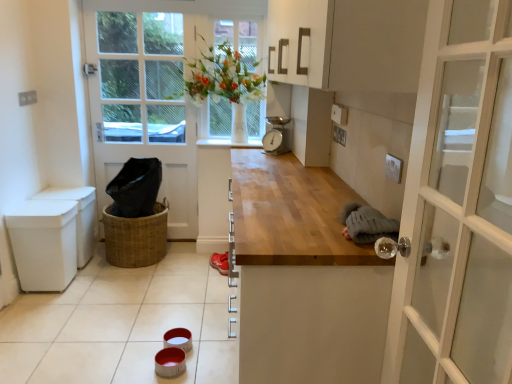
This screenshot has height=384, width=512. What do you see at coordinates (276, 136) in the screenshot? I see `metallic gray scale at upper center` at bounding box center [276, 136].

The width and height of the screenshot is (512, 384). Describe the element at coordinates (121, 324) in the screenshot. I see `white glossy tile at lower center` at that location.

This screenshot has height=384, width=512. Find the location of `white wooden door at left`. white wooden door at left is located at coordinates (143, 105).

What is the approximate width of white plastic bin at left?

white plastic bin at left is 14.85 inches wide.

Locate an element on the screen. The height and width of the screenshot is (384, 512). woven brown basket at lower left is located at coordinates (136, 237).

Identify the location of translucent glass window at center. (229, 78).

How many degrees apart are the facing directions of white plastic bin at left and metallic gray scale at upper center?

white plastic bin at left and metallic gray scale at upper center are facing 126 degrees away from each other.

In the scene shown: Can you confirm if white plastic bin at left is wider than metallic gray scale at upper center?

Correct, the width of white plastic bin at left exceeds that of metallic gray scale at upper center.

Measure the distance between white plastic bin at left and metallic gray scale at upper center.

1.50 meters.

Can metallic gray scale at upper center be found inside white plastic bin at left?

No, metallic gray scale at upper center is not inside white plastic bin at left.

From a real-world perspective, is woven brown basket at lower left on translucent glass window at center?

No, from a real-world perspective, woven brown basket at lower left is not on top of translucent glass window at center.

Can translucent glass window at center be found inside woven brown basket at lower left?

No, translucent glass window at center is not a part of woven brown basket at lower left.

Does woven brown basket at lower left turn towards translucent glass window at center?

No, woven brown basket at lower left is not turned towards translucent glass window at center.

Between white wooden door at left and translucent glass window at center, which one appears on the left side from the viewer's perspective?

Positioned to the left is white wooden door at left.

Would you consider white wooden door at left to be distant from translucent glass window at center?

Actually, white wooden door at left and translucent glass window at center are a little close together.

From a real-world perspective, is white wooden door at left on translucent glass window at center?

Incorrect, from a real-world perspective, white wooden door at left is lower than translucent glass window at center.

Does white wooden door at left lie in front of translucent glass window at center?

That is True.

Is translucent glass window at center surrounded by white plastic bin at left?

No, translucent glass window at center is not inside white plastic bin at left.

Considering the points (80, 229) and (233, 119), which point is behind, point (80, 229) or point (233, 119)?

The point (233, 119) is more distant.

In the scene shown: From the image's perspective, is white plastic bin at left under translucent glass window at center?

Indeed, from the image's perspective, white plastic bin at left is shown beneath translucent glass window at center.

From a real-world perspective, is white plastic bin at left physically below translucent glass window at center?

Correct, in the physical world, white plastic bin at left is lower than translucent glass window at center.

Which object is further away from the camera, metallic gray scale at upper center or white wooden door at left?

white wooden door at left is more distant.

From a real-world perspective, which object stands above the other?

metallic gray scale at upper center.

Between point (278, 149) and point (151, 46), which one is positioned in front?

Positioned in front is point (278, 149).

From the image's perspective, does metallic gray scale at upper center appear higher than white wooden door at left?

No.

Is white glossy tile at lower center in front of or behind translucent glass window at center in the image?

In the image, white glossy tile at lower center appears in front of translucent glass window at center.

Which is farther, (22, 354) or (227, 90)?

The point (227, 90) is behind.

Is white glossy tile at lower center not inside translucent glass window at center?

Yes, white glossy tile at lower center is not within translucent glass window at center.

Is white glossy tile at lower center not close to translucent glass window at center?

white glossy tile at lower center is far away from translucent glass window at center.

Is white glossy tile at lower center surrounded by translucent glass window at center?

No, white glossy tile at lower center is not inside translucent glass window at center.

Is translucent glass window at center oriented away from white glossy tile at lower center?

No.

Is translucent glass window at center directly adjacent to white glossy tile at lower center?

translucent glass window at center and white glossy tile at lower center are clearly separated.

Relative to white glossy tile at lower center, is translucent glass window at center in front or behind?

translucent glass window at center is behind white glossy tile at lower center.

In the image, there is a white plastic bin at left. Identify the location of appliance above it (from the image's perspective). The height and width of the screenshot is (384, 512). (276, 136).

Locate an element on the screen. The height and width of the screenshot is (384, 512). basket lying on the left of translucent glass window at center is located at coordinates (136, 237).

Which object lies nearer to the anchor point translucent glass window at center, white plastic bin at left or metallic gray scale at upper center?

Among the two, metallic gray scale at upper center is located nearer to translucent glass window at center.

From the image, which object appears to be farther from white wooden door at left, woven brown basket at lower left or translucent glass window at center?

Result: woven brown basket at lower left is further to white wooden door at left.

When comparing their distances from woven brown basket at lower left, does metallic gray scale at upper center or white wooden door at left seem closer?

white wooden door at left.

Based on their spatial positions, is white wooden door at left or woven brown basket at lower left further from metallic gray scale at upper center?

Among the two, woven brown basket at lower left is located further to metallic gray scale at upper center.

When comparing their distances from translucent glass window at center, does metallic gray scale at upper center or white glossy tile at lower center seem closer?

metallic gray scale at upper center lies closer to translucent glass window at center than the other object.

From the image, which object appears to be farther from woven brown basket at lower left, white wooden door at left or white plastic bin at left?

Among the two, white wooden door at left is located further to woven brown basket at lower left.

Which object lies nearer to the anchor point white plastic bin at left, woven brown basket at lower left or translucent glass window at center?

Among the two, woven brown basket at lower left is located nearer to white plastic bin at left.

Which object lies nearer to the anchor point white wooden door at left, metallic gray scale at upper center or translucent glass window at center?

Among the two, translucent glass window at center is located nearer to white wooden door at left.

Image resolution: width=512 pixels, height=384 pixels. I want to click on tile located between white plastic bin at left and metallic gray scale at upper center in the left-right direction, so click(x=121, y=324).

Image resolution: width=512 pixels, height=384 pixels. Identify the location of door situated between white plastic bin at left and metallic gray scale at upper center from left to right. (143, 105).

Identify the location of appliance between translucent glass window at center and woven brown basket at lower left from top to bottom. This screenshot has width=512, height=384. (276, 136).

Locate an element on the screen. cabinetry between white wooden door at left and woven brown basket at lower left in the vertical direction is located at coordinates (78, 216).